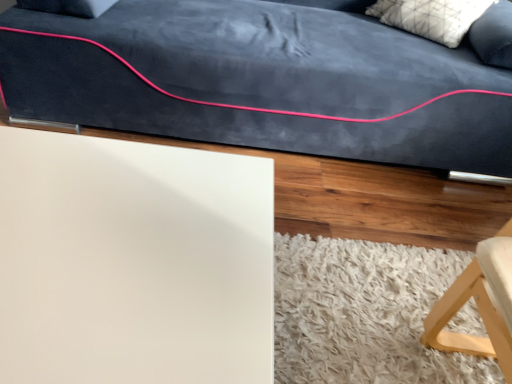
The width and height of the screenshot is (512, 384). I want to click on white textured pillow at upper right, so click(x=431, y=17).

What do you see at coordinates (364, 313) in the screenshot? The height and width of the screenshot is (384, 512). I see `white shaggy rug at lower right` at bounding box center [364, 313].

At what (x,y) coordinates should I click in order to perform the action: click on white matte board at lower left. Please return your answer as a coordinate pair (x, y). Looking at the image, I should click on (133, 262).

Identify the location of white textured pillow at upper right. This screenshot has height=384, width=512. (431, 17).

Is point (432, 28) positioned after point (168, 249)?

Yes, it is behind point (168, 249).

From a real-world perspective, is white textured pillow at upper right located beneath white matte board at lower left?

Actually, white textured pillow at upper right is physically above white matte board at lower left in the real world.

Considering their positions, is white textured pillow at upper right located in front of or behind white matte board at lower left?

Visually, white textured pillow at upper right is located behind white matte board at lower left.

Is white textured pillow at upper right far away from white matte board at lower left?

Yes, white textured pillow at upper right and white matte board at lower left are quite far apart.

Between white matte board at lower left and white textured pillow at upper right, which one has smaller width?

With smaller width is white textured pillow at upper right.

Is white matte board at lower left not close to white textured pillow at upper right?

Yes.

In the scene shown: From a real-world perspective, is white matte board at lower left above or below white textured pillow at upper right?

In terms of real-world spatial position, white matte board at lower left is below white textured pillow at upper right.

Is white matte board at lower left looking in the opposite direction of white textured pillow at upper right?

No.

In the scene shown: Considering the positions of objects white shaggy rug at lower right and white textured pillow at upper right in the image provided, who is in front, white shaggy rug at lower right or white textured pillow at upper right?

white shaggy rug at lower right is more forward.

From a real-world perspective, is white shaggy rug at lower right above or below white textured pillow at upper right?

white shaggy rug at lower right is below white textured pillow at upper right.

What's the angular difference between white shaggy rug at lower right and white textured pillow at upper right's facing directions?

The facing directions of white shaggy rug at lower right and white textured pillow at upper right are 134 degrees apart.

The image size is (512, 384). I want to click on mat on the left of white textured pillow at upper right, so click(x=364, y=313).

Could you tell me if white matte board at lower left is turned towards white shaggy rug at lower right?

No, white matte board at lower left is not oriented towards white shaggy rug at lower right.

Considering the sizes of white matte board at lower left and white shaggy rug at lower right in the image, is white matte board at lower left taller or shorter than white shaggy rug at lower right?

white matte board at lower left is taller than white shaggy rug at lower right.

From the picture: Can you confirm if white matte board at lower left is positioned to the left of white shaggy rug at lower right?

Yes.

From a real-world perspective, does white matte board at lower left sit lower than white shaggy rug at lower right?

No, from a real-world perspective, white matte board at lower left is not below white shaggy rug at lower right.

Which object is thinner, white shaggy rug at lower right or white matte board at lower left?

Thinner between the two is white matte board at lower left.

Is white shaggy rug at lower right smaller than white matte board at lower left?

Correct, white shaggy rug at lower right occupies less space than white matte board at lower left.

Could you tell me if white shaggy rug at lower right is facing white matte board at lower left?

No.

How much distance is there between white shaggy rug at lower right and white matte board at lower left?

white shaggy rug at lower right is 55.54 centimeters away from white matte board at lower left.

Is point (417, 13) in front of point (329, 318)?

No, it is not.

Considering the relative sizes of white textured pillow at upper right and white shaggy rug at lower right in the image provided, is white textured pillow at upper right taller than white shaggy rug at lower right?

Yes.

Is white textured pillow at upper right placed right next to white shaggy rug at lower right?

No, white textured pillow at upper right is not making contact with white shaggy rug at lower right.

From the image's perspective, which is above, white textured pillow at upper right or white shaggy rug at lower right?

white textured pillow at upper right is shown above in the image.

Locate an element on the screen. This screenshot has height=384, width=512. pillow that appears above the white matte board at lower left (from a real-world perspective) is located at coordinates (431, 17).

I want to click on table to the left of white textured pillow at upper right, so click(133, 262).

Estimate the real-world distances between objects in this image. Which object is closer to white textured pillow at upper right, white shaggy rug at lower right or white matte board at lower left?

Based on the image, white shaggy rug at lower right appears to be nearer to white textured pillow at upper right.

Which object lies nearer to the anchor point white shaggy rug at lower right, white textured pillow at upper right or white matte board at lower left?

Among the two, white matte board at lower left is located nearer to white shaggy rug at lower right.

Estimate the real-world distances between objects in this image. Which object is closer to white matte board at lower left, white textured pillow at upper right or white shaggy rug at lower right?

Among the two, white shaggy rug at lower right is located nearer to white matte board at lower left.

From the image, which object appears to be nearer to white shaggy rug at lower right, white matte board at lower left or white textured pillow at upper right?

white matte board at lower left is closer to white shaggy rug at lower right.

Considering their positions, is white shaggy rug at lower right positioned closer to white matte board at lower left than white textured pillow at upper right?

Based on the image, white shaggy rug at lower right appears to be nearer to white matte board at lower left.

Which object lies nearer to the anchor point white textured pillow at upper right, white matte board at lower left or white shaggy rug at lower right?

Among the two, white shaggy rug at lower right is located nearer to white textured pillow at upper right.

At what (x,y) coordinates should I click in order to perform the action: click on table that lies between white textured pillow at upper right and white shaggy rug at lower right from top to bottom. Please return your answer as a coordinate pair (x, y). The width and height of the screenshot is (512, 384). Looking at the image, I should click on (133, 262).